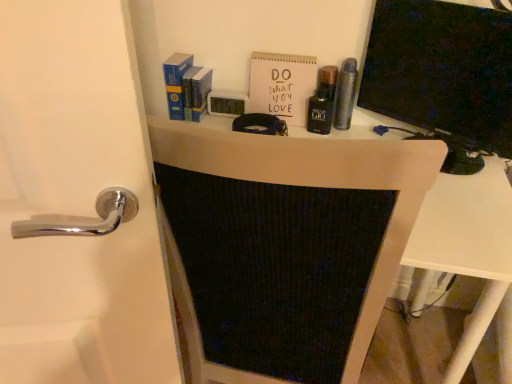
Question: Is metallic silver canister at center, positioned as the 2th toiletry in left-to-right order, wider than blue hardcover book at upper left?

Choices:
 (A) no
 (B) yes

Answer: (A)

Question: Does metallic silver canister at center, the first toiletry when ordered from right to left, have a greater height compared to blue hardcover book at upper left?

Choices:
 (A) yes
 (B) no

Answer: (A)

Question: Is metallic silver canister at center, positioned as the 2th toiletry in left-to-right order, far away from blue hardcover book at upper left?

Choices:
 (A) no
 (B) yes

Answer: (A)

Question: Could blue hardcover book at upper left be considered to be inside metallic silver canister at center, positioned as the 2th toiletry in left-to-right order?

Choices:
 (A) yes
 (B) no

Answer: (B)

Question: Can we say metallic silver canister at center, positioned as the 2th toiletry in left-to-right order, lies outside blue hardcover book at upper left?

Choices:
 (A) no
 (B) yes

Answer: (B)

Question: Is metallic silver canister at center, the first toiletry when ordered from right to left, shorter than blue hardcover book at upper left?

Choices:
 (A) no
 (B) yes

Answer: (A)

Question: Can we say metallic silver canister at center, the first toiletry when ordered from right to left, lies outside black glass bottle at upper center, placed as the second toiletry when sorted from right to left?

Choices:
 (A) no
 (B) yes

Answer: (B)

Question: Could you tell me if metallic silver canister at center, positioned as the 2th toiletry in left-to-right order, is turned towards black glass bottle at upper center, placed as the second toiletry when sorted from right to left?

Choices:
 (A) yes
 (B) no

Answer: (B)

Question: Is black glass bottle at upper center, placed as the second toiletry when sorted from right to left, located within metallic silver canister at center, positioned as the 2th toiletry in left-to-right order?

Choices:
 (A) no
 (B) yes

Answer: (A)

Question: Is metallic silver canister at center, positioned as the 2th toiletry in left-to-right order, positioned before black glass bottle at upper center, placed as the second toiletry when sorted from right to left?

Choices:
 (A) no
 (B) yes

Answer: (B)

Question: Is metallic silver canister at center, positioned as the 2th toiletry in left-to-right order, positioned far away from black glass bottle at upper center, the 1th toiletry from the left?

Choices:
 (A) no
 (B) yes

Answer: (A)

Question: Does metallic silver canister at center, positioned as the 2th toiletry in left-to-right order, have a lesser height compared to black glass bottle at upper center, placed as the second toiletry when sorted from right to left?

Choices:
 (A) no
 (B) yes

Answer: (A)

Question: Is white matte paper at upper center shorter than matte black monitor at right?

Choices:
 (A) no
 (B) yes

Answer: (B)